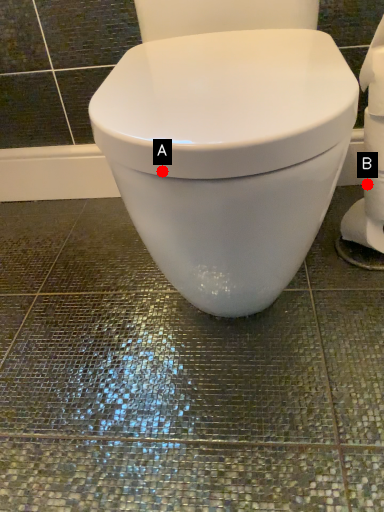
Question: Two points are circled on the image, labeled by A and B beside each circle. Among these points, which one is farthest from the camera?

Choices:
 (A) A is further
 (B) B is further

Answer: (B)